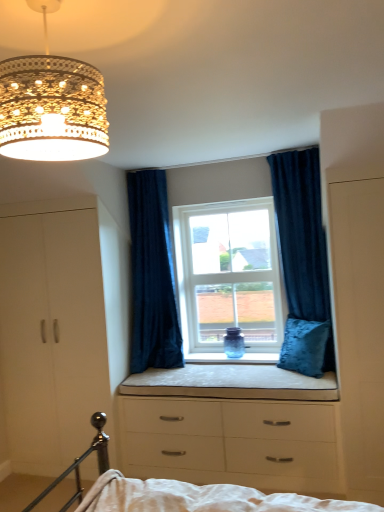
Question: Is white glass window at center facing away from velvet blue pillow at center?

Choices:
 (A) yes
 (B) no

Answer: (B)

Question: Is white glass window at center next to velvet blue pillow at center and touching it?

Choices:
 (A) yes
 (B) no

Answer: (B)

Question: Does white glass window at center have a lesser width compared to velvet blue pillow at center?

Choices:
 (A) yes
 (B) no

Answer: (A)

Question: From the image's perspective, is white glass window at center on velvet blue pillow at center?

Choices:
 (A) yes
 (B) no

Answer: (A)

Question: Can you confirm if white glass window at center is taller than velvet blue pillow at center?

Choices:
 (A) no
 (B) yes

Answer: (B)

Question: From a real-world perspective, is white glass window at center above or below velvet dark blue curtain at center, acting as the first curtain starting from the left?

Choices:
 (A) above
 (B) below

Answer: (B)

Question: Considering their positions, is white glass window at center located in front of or behind velvet dark blue curtain at center, placed as the 2th curtain when sorted from right to left?

Choices:
 (A) front
 (B) behind

Answer: (B)

Question: In terms of height, does white glass window at center look taller or shorter compared to velvet dark blue curtain at center, acting as the first curtain starting from the left?

Choices:
 (A) tall
 (B) short

Answer: (B)

Question: Is white glass window at center inside or outside of velvet dark blue curtain at center, acting as the first curtain starting from the left?

Choices:
 (A) outside
 (B) inside

Answer: (A)

Question: From the image's perspective, relative to velvet blue curtain at upper right, which appears as the 1th curtain when viewed from the right, is white glass window at center above or below?

Choices:
 (A) below
 (B) above

Answer: (A)

Question: Is white glass window at center taller or shorter than velvet blue curtain at upper right, which appears as the 1th curtain when viewed from the right?

Choices:
 (A) tall
 (B) short

Answer: (B)

Question: In the image, is white glass window at center on the left side or the right side of velvet blue curtain at upper right, which is counted as the 2th curtain, starting from the left?

Choices:
 (A) right
 (B) left

Answer: (B)

Question: In terms of size, does white glass window at center appear bigger or smaller than velvet blue curtain at upper right, which appears as the 1th curtain when viewed from the right?

Choices:
 (A) big
 (B) small

Answer: (B)

Question: Would you say beige fabric cushion at center is to the left or to the right of velvet dark blue curtain at center, acting as the first curtain starting from the left, in the picture?

Choices:
 (A) right
 (B) left

Answer: (A)

Question: Considering the positions of beige fabric cushion at center and velvet dark blue curtain at center, acting as the first curtain starting from the left, in the image, is beige fabric cushion at center bigger or smaller than velvet dark blue curtain at center, acting as the first curtain starting from the left,?

Choices:
 (A) small
 (B) big

Answer: (A)